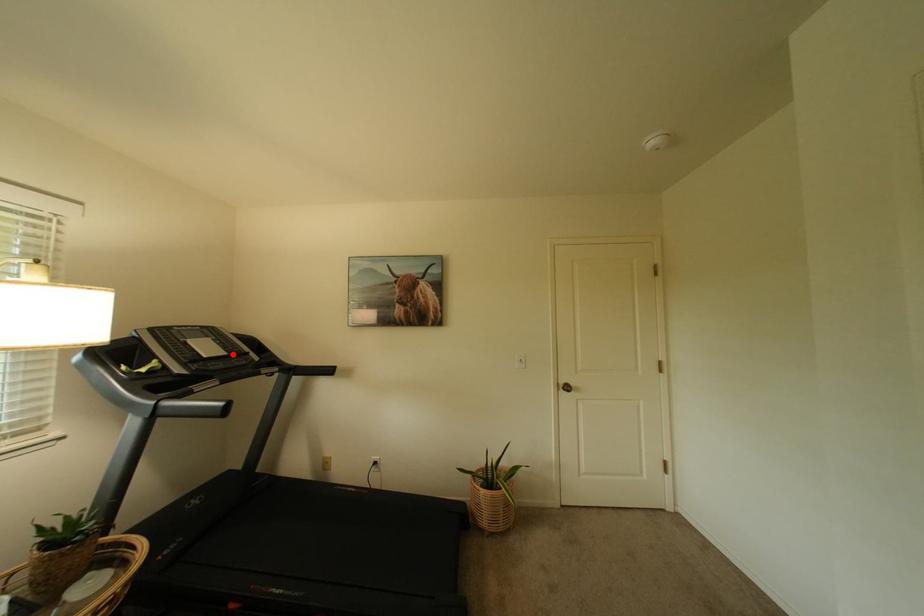
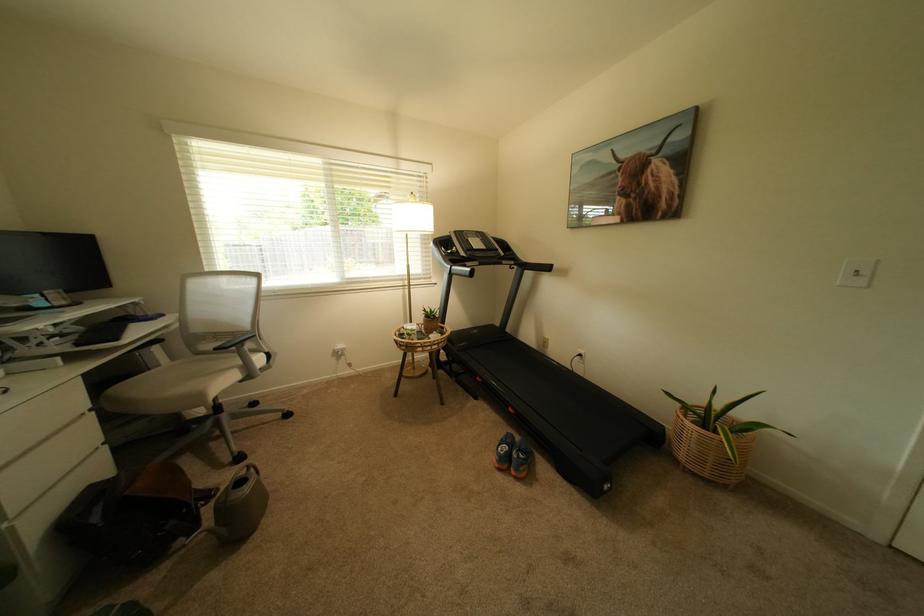
In the second image, find the point that corresponds to the highlighted location in the first image.

(493, 249)